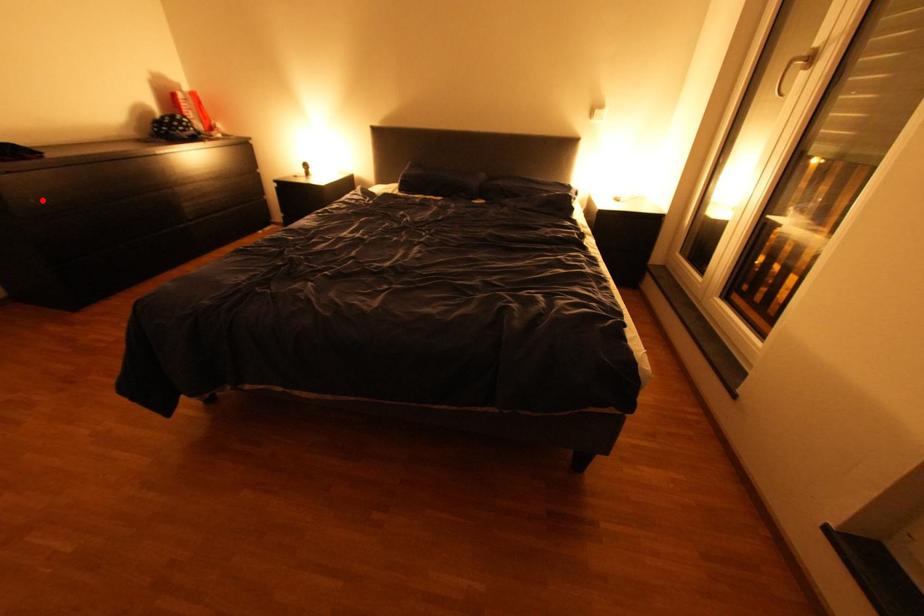
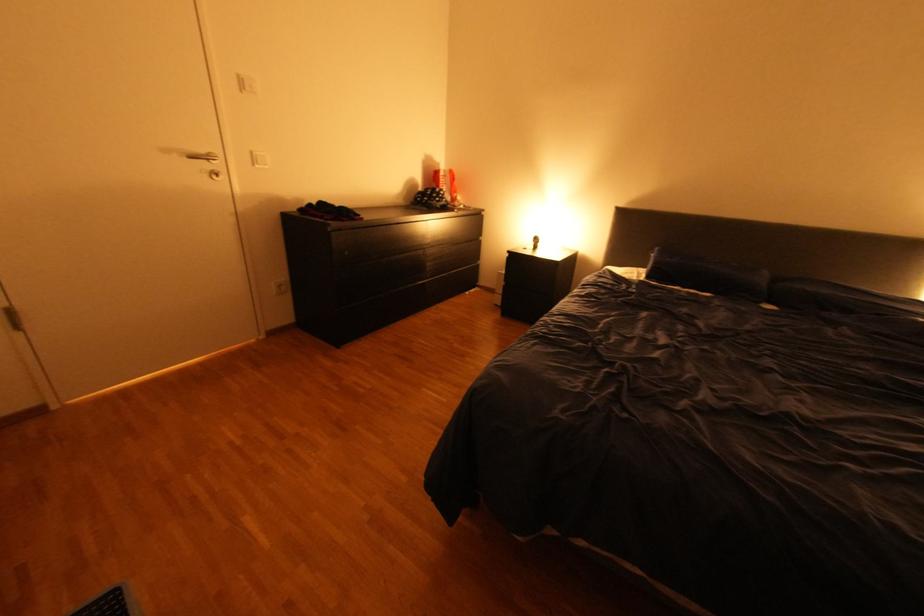
Question: I am providing you with two images of the same scene from different viewpoints. In image1, a red point is highlighted. Considering the same 3D point in image2, which of the following is correct?

Choices:
 (A) It is closer
 (B) It is farther

Answer: (A)